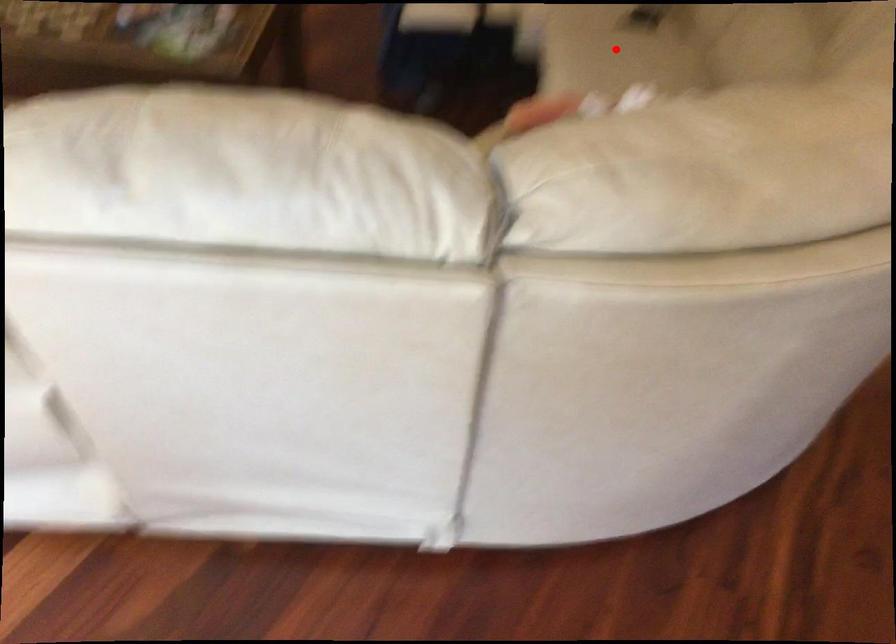
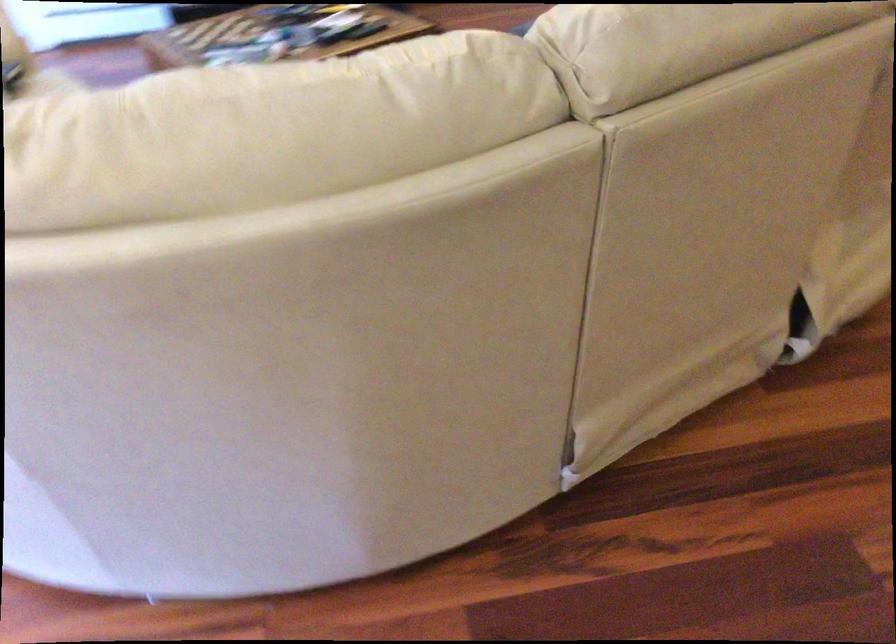
Question: I am providing you with two images of the same scene from different viewpoints. A red point is marked on the first image. Is the red point's position out of view in image 2?

Choices:
 (A) Yes
 (B) No

Answer: (A)